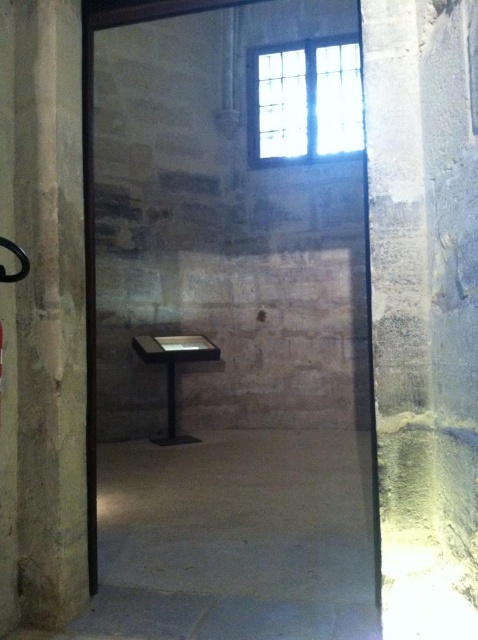
Question: Which object is the closest to the smooth stone pillar at left?

Choices:
 (A) matte black table at center
 (B) clear glass window at upper center

Answer: (A)

Question: Considering the relative positions of smooth stone pillar at left and matte black table at center in the image provided, where is smooth stone pillar at left located with respect to matte black table at center?

Choices:
 (A) right
 (B) left

Answer: (A)

Question: Can you confirm if smooth stone pillar at left is positioned to the right of matte black table at center?

Choices:
 (A) yes
 (B) no

Answer: (A)

Question: Can you confirm if clear glass window at upper center is positioned above matte black table at center?

Choices:
 (A) no
 (B) yes

Answer: (B)

Question: Among these objects, which one is farthest from the camera?

Choices:
 (A) clear glass window at upper center
 (B) smooth stone pillar at left

Answer: (A)

Question: Which of the following is the closest to the observer?

Choices:
 (A) matte black table at center
 (B) smooth stone pillar at left

Answer: (B)